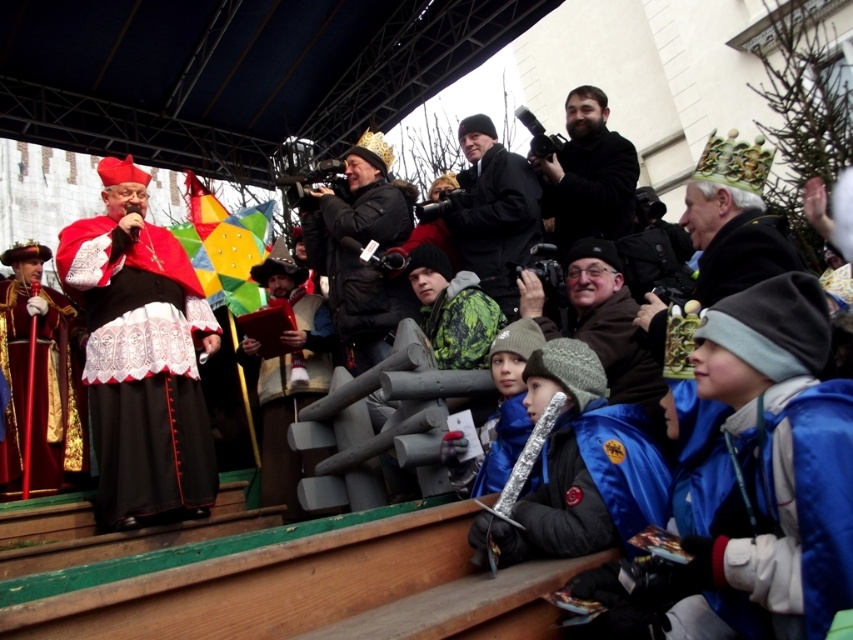
Can you confirm if matte black robe at center is positioned to the right of silver metallic sword at lower center?

No, matte black robe at center is not to the right of silver metallic sword at lower center.

Which is more to the right, matte black robe at center or silver metallic sword at lower center?

From the viewer's perspective, silver metallic sword at lower center appears more on the right side.

Is point (178, 352) less distant than point (537, 554)?

No, it is behind (537, 554).

Find the location of a particular element. matte black robe at center is located at coordinates (142, 365).

Which of these two, blue fleece jacket at lower right or black matte jacket at upper center, stands taller?

black matte jacket at upper center

Where is `blue fleece jacket at lower right`? This screenshot has height=640, width=853. blue fleece jacket at lower right is located at coordinates (792, 506).

Measure the distance between blue fleece jacket at lower right and camera.

They are 28.73 meters apart.

The width and height of the screenshot is (853, 640). I want to click on blue fleece jacket at lower right, so click(792, 506).

Who is shorter, blue fleece jacket at lower right or matte black camera at center?

Standing shorter between the two is blue fleece jacket at lower right.

Who is positioned more to the right, blue fleece jacket at lower right or matte black camera at center?

Positioned to the right is blue fleece jacket at lower right.

The height and width of the screenshot is (640, 853). Describe the element at coordinates (792, 506) in the screenshot. I see `blue fleece jacket at lower right` at that location.

Where is `blue fleece jacket at lower right`? blue fleece jacket at lower right is located at coordinates (792, 506).